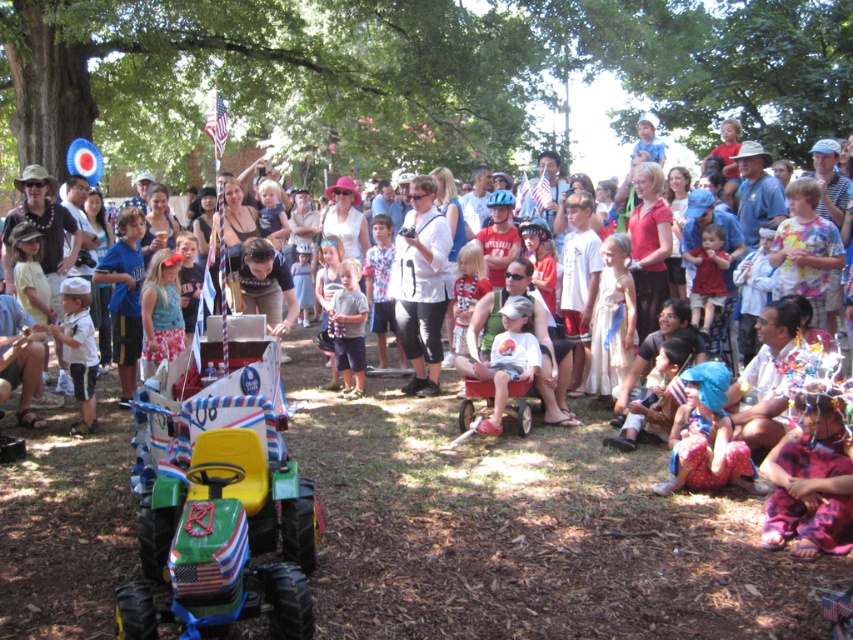
From the picture: You are a child at the event and want to play with both the green plastic toy car at center and the blue fabric hat at lower right. Which object can you pick up more easily due to its size?

The green plastic toy car at center is larger than the blue fabric hat at lower right, so the blue fabric hat at lower right is smaller and easier to pick up.

You are a photographer at the event and want to ensure both the white matte shirt at center and the light blue denim shorts at center are visible in your photo. Which clothing item should you focus on to frame the shot properly?

The white matte shirt at center has a larger size compared to the light blue denim shorts at center, so focusing on the white matte shirt at center will help frame the shot properly to include both items.